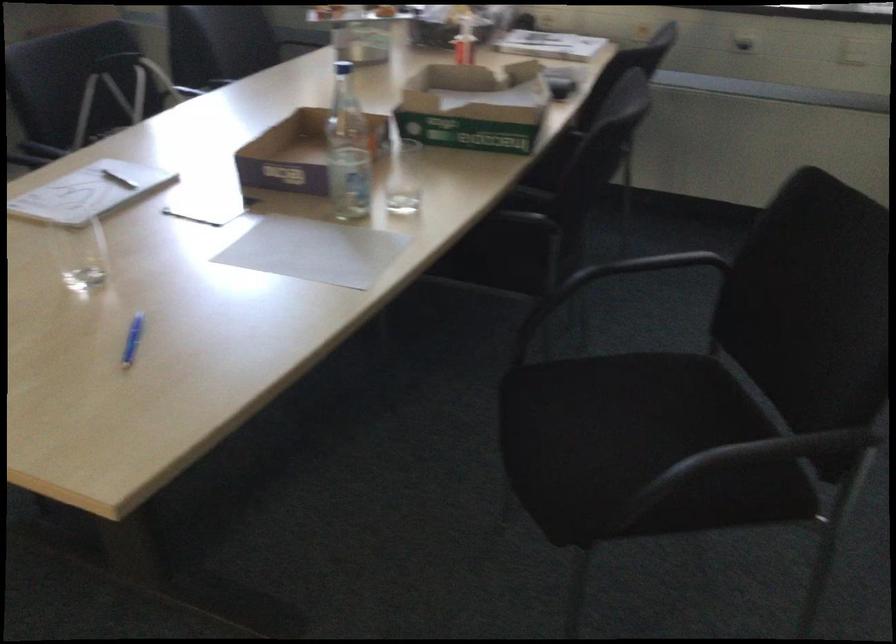
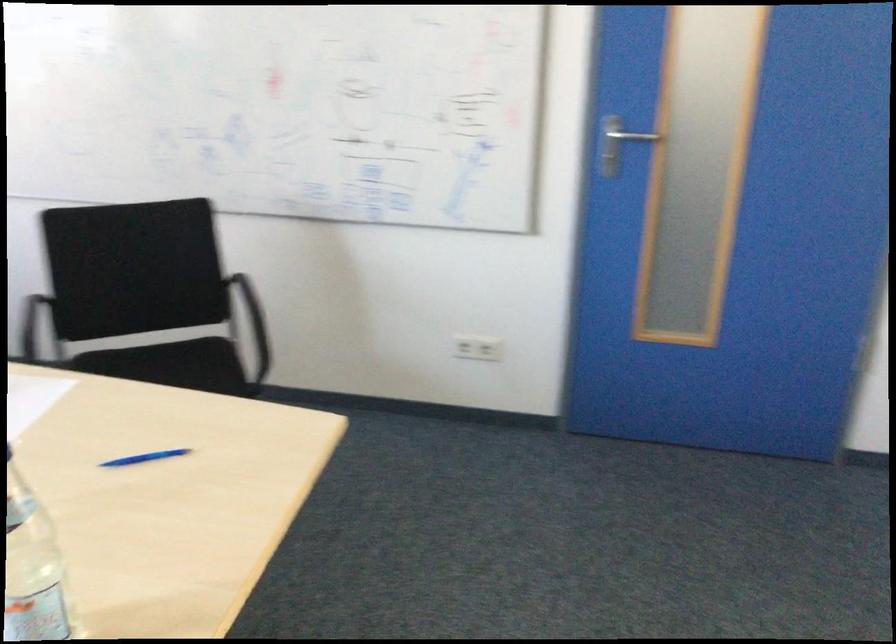
Where in the second image is the point corresponding to the point at 138,368 from the first image?

(143, 458)